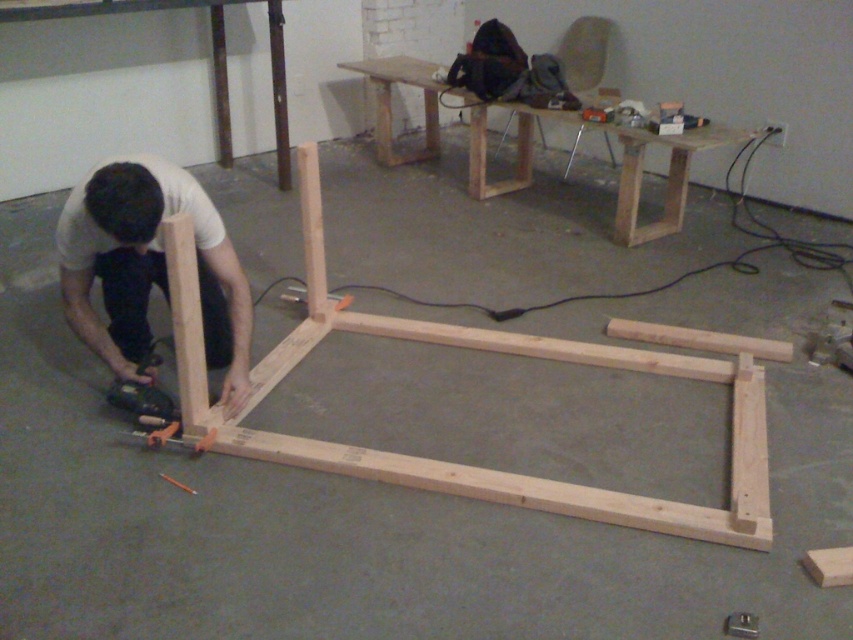
Question: Considering the real-world distances, which object is farthest from the natural wood workbench at upper center?

Choices:
 (A) light brown wood plank at lower right
 (B) natural wood plank at center
 (C) natural wood frame at center
 (D) metallic gray drill at lower left

Answer: (A)

Question: Which of these objects is positioned closest to the natural wood plank at center?

Choices:
 (A) light brown wood plank at lower right
 (B) matte wood man at lower left
 (C) natural wood frame at center

Answer: (C)

Question: Where is natural wood frame at center located in relation to natural wood workbench at upper center in the image?

Choices:
 (A) right
 (B) left

Answer: (A)

Question: Which object appears farthest from the camera in this image?

Choices:
 (A) natural wood frame at center
 (B) natural wood plank at center
 (C) matte wood man at lower left

Answer: (B)

Question: Does matte wood man at lower left appear on the left side of light brown wood plank at lower right?

Choices:
 (A) yes
 (B) no

Answer: (A)

Question: Can you confirm if natural wood plank at center is positioned above light brown wood plank at lower right?

Choices:
 (A) yes
 (B) no

Answer: (A)